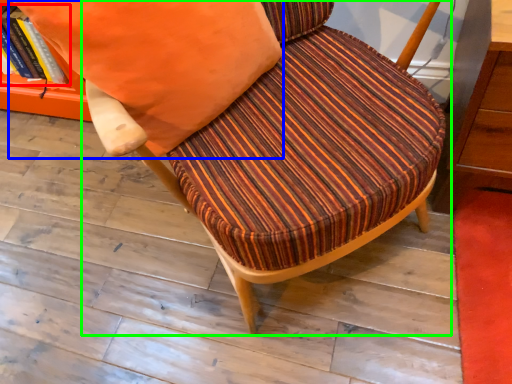
Question: Which object is positioned closest to book (highlighted by a red box)? Select from throw pillow (highlighted by a blue box) and chair (highlighted by a green box).

Choices:
 (A) throw pillow
 (B) chair

Answer: (A)